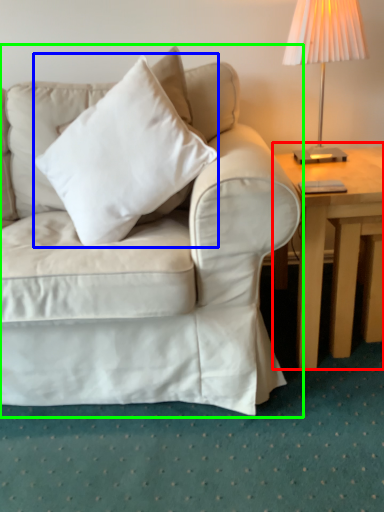
Question: Estimate the real-world distances between objects in this image. Which object is farther from table (highlighted by a red box), pillow (highlighted by a blue box) or studio couch (highlighted by a green box)?

Choices:
 (A) pillow
 (B) studio couch

Answer: (A)